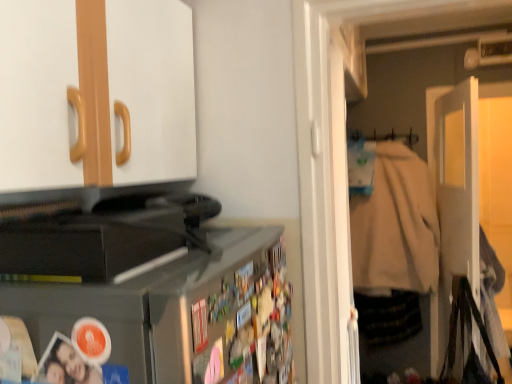
Question: Is black plastic toaster at lower left located within white matte door at right?

Choices:
 (A) yes
 (B) no

Answer: (B)

Question: Can you confirm if white matte door at right is positioned to the left of black plastic toaster at lower left?

Choices:
 (A) no
 (B) yes

Answer: (A)

Question: Does white matte door at right have a greater width compared to black plastic toaster at lower left?

Choices:
 (A) no
 (B) yes

Answer: (A)

Question: Is white matte door at right next to black plastic toaster at lower left and touching it?

Choices:
 (A) yes
 (B) no

Answer: (B)

Question: Is white matte door at right smaller than black plastic toaster at lower left?

Choices:
 (A) yes
 (B) no

Answer: (B)

Question: Is white matte door at right aimed at black plastic toaster at lower left?

Choices:
 (A) yes
 (B) no

Answer: (B)

Question: From the image's perspective, is white matte door at right under beige cotton jacket at right?

Choices:
 (A) no
 (B) yes

Answer: (B)

Question: Is white matte door at right shorter than beige cotton jacket at right?

Choices:
 (A) no
 (B) yes

Answer: (A)

Question: From a real-world perspective, is white matte door at right on top of beige cotton jacket at right?

Choices:
 (A) no
 (B) yes

Answer: (A)

Question: Is white matte door at right surrounding beige cotton jacket at right?

Choices:
 (A) yes
 (B) no

Answer: (B)

Question: Is white matte door at right positioned before beige cotton jacket at right?

Choices:
 (A) no
 (B) yes

Answer: (B)

Question: Is white matte door at right positioned with its back to beige cotton jacket at right?

Choices:
 (A) yes
 (B) no

Answer: (A)

Question: From the image's perspective, is white fabric hanger at upper right on black plastic toaster at lower left?

Choices:
 (A) no
 (B) yes

Answer: (B)